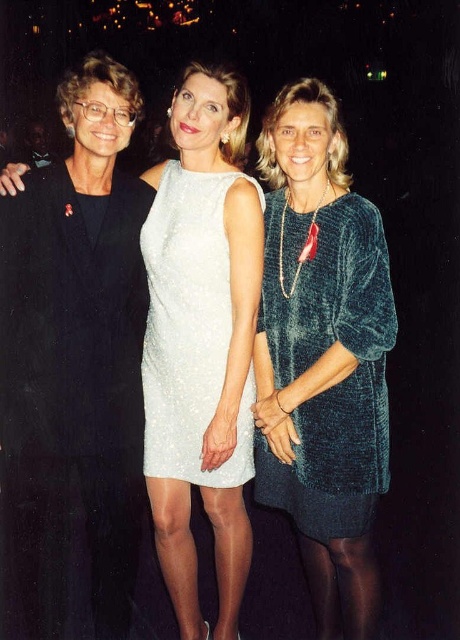
Question: Considering the relative positions of velvet green dress at center and white sequined dress at center in the image provided, where is velvet green dress at center located with respect to white sequined dress at center?

Choices:
 (A) above
 (B) below

Answer: (B)

Question: Is velvet green dress at center positioned in front of white sequined dress at center?

Choices:
 (A) yes
 (B) no

Answer: (A)

Question: Which point is farther to the camera?

Choices:
 (A) (216, 212)
 (B) (305, 524)

Answer: (B)

Question: Which point is farther to the camera?

Choices:
 (A) (327, 157)
 (B) (223, 273)

Answer: (B)

Question: Does velvet green dress at center have a greater width compared to white sequined dress at center?

Choices:
 (A) no
 (B) yes

Answer: (B)